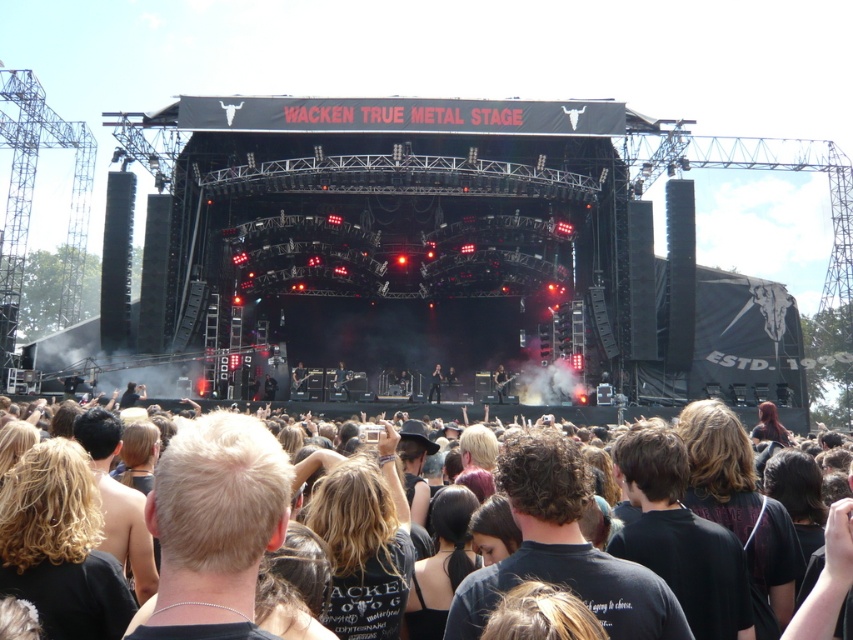
You are a photographer at the music festival and want to capture both the dark brown leather jacket at center and the shiny black guitar at center in your shot. Which object will appear bigger in your photo?

The dark brown leather jacket at center will appear bigger in the photo because it has a larger size compared to the shiny black guitar at center.